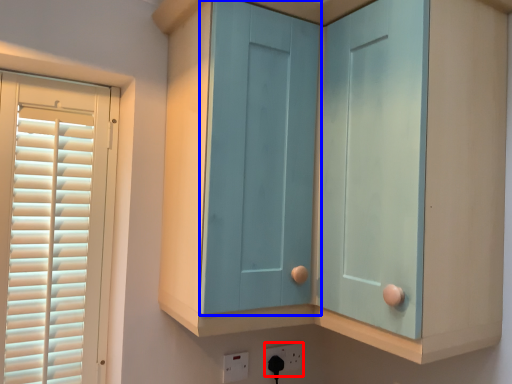
Question: Which of the following is the farthest to the observer, electric outlet (highlighted by a red box) or screen door (highlighted by a blue box)?

Choices:
 (A) electric outlet
 (B) screen door

Answer: (A)